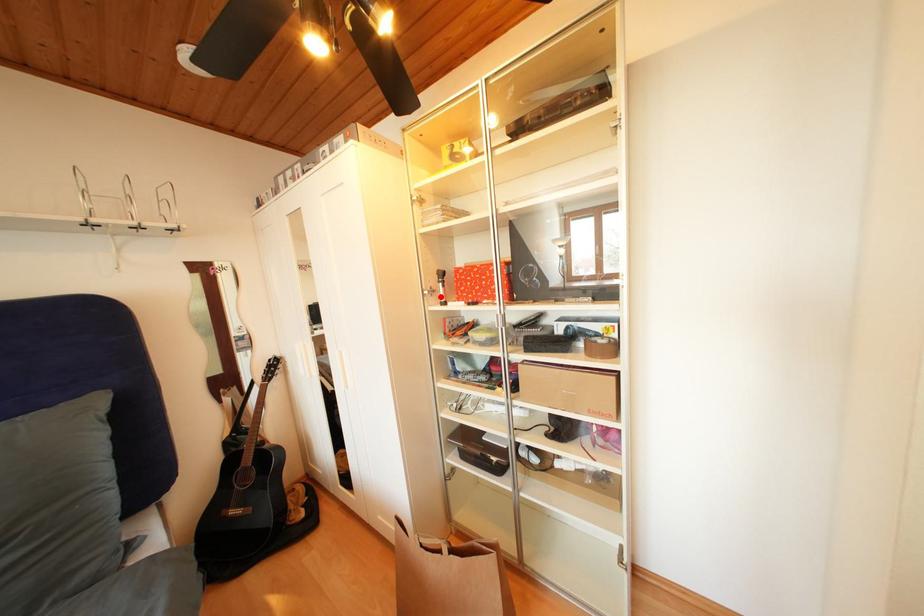
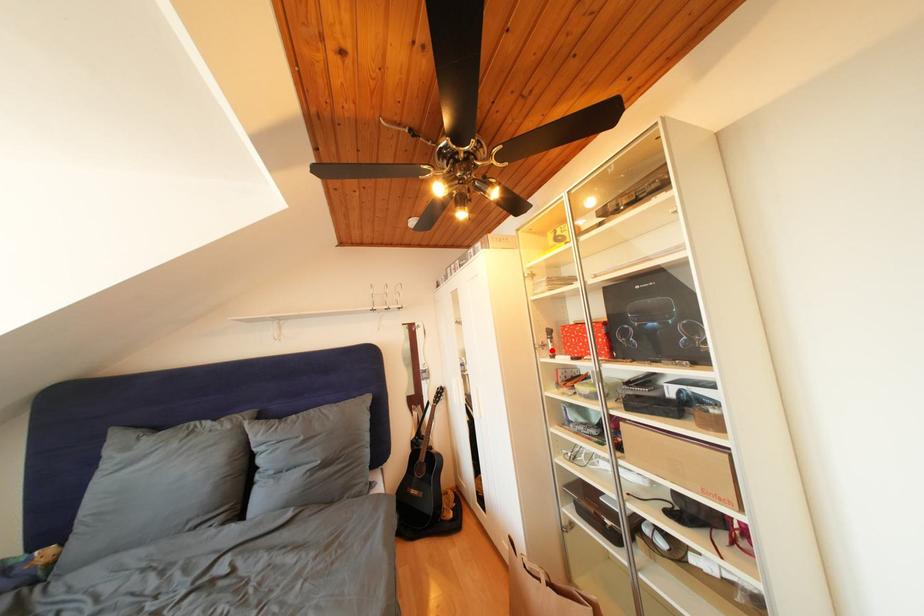
I am providing you with two images of the same scene from different viewpoints. A red point is marked on the first image and another point is marked on the second image. Is the red point in image1 aligned with the point shown in image2?

Yes